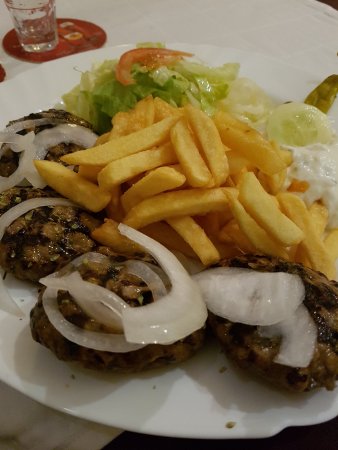
Where is `table`? This screenshot has width=338, height=450. table is located at coordinates (247, 41).